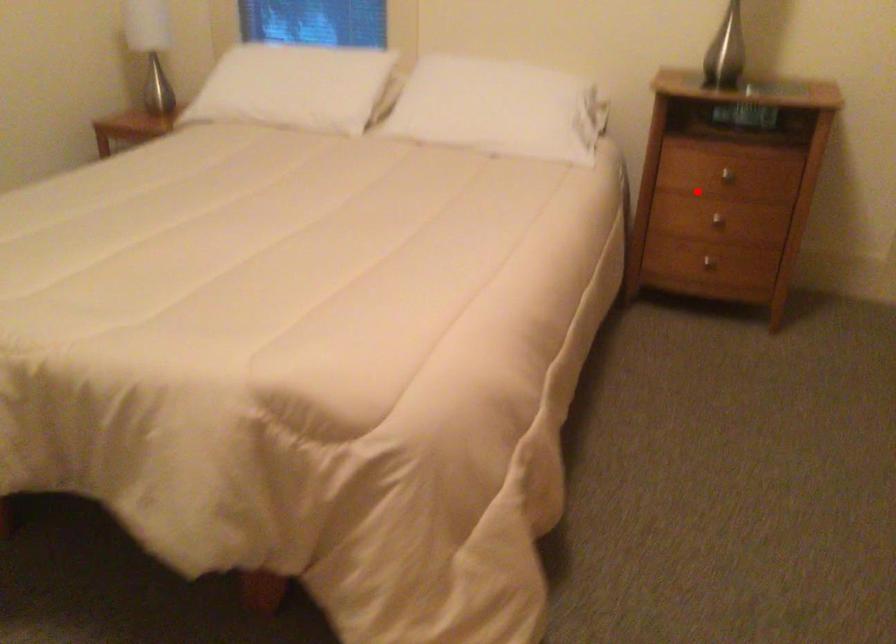
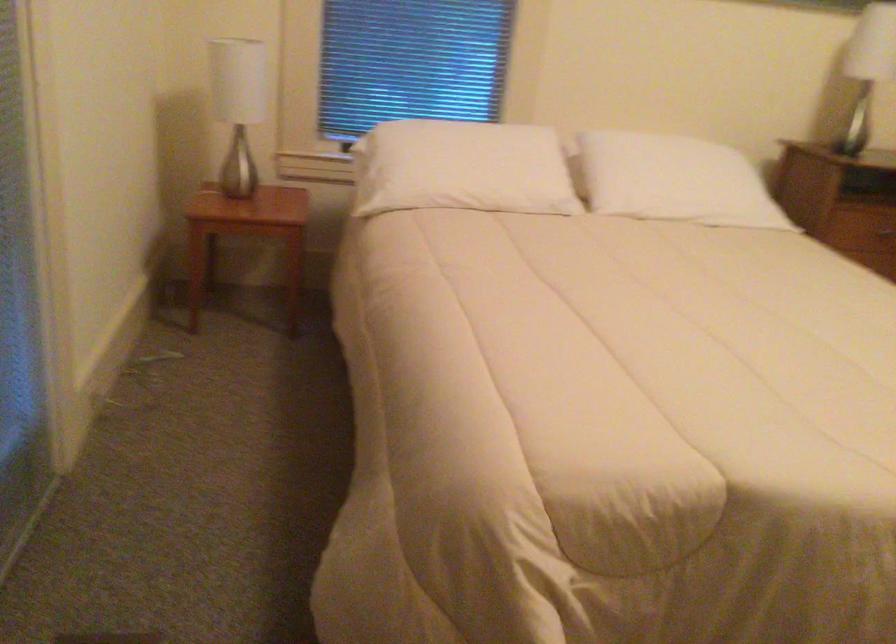
Find the pixel in the second image that matches the highlighted location in the first image.

(883, 232)